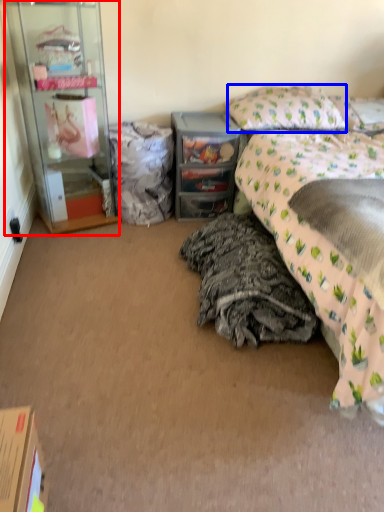
Question: Which point is closer to the camera, cabinetry (highlighted by a red box) or pillow (highlighted by a blue box)?

Choices:
 (A) cabinetry
 (B) pillow

Answer: (A)